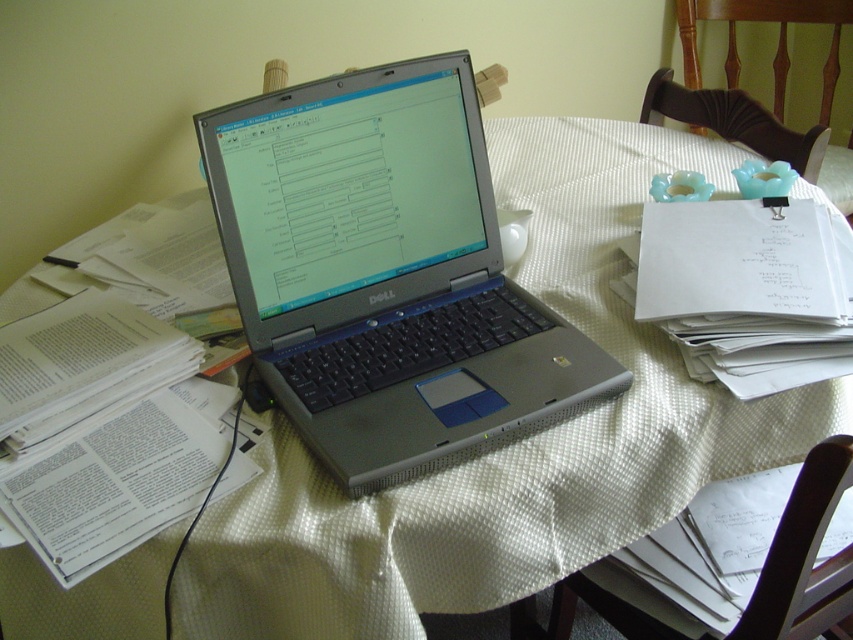
How distant is silver metallic laptop at center from white paper at upper right?

9.87 inches

Which of these two, silver metallic laptop at center or white paper at upper right, stands taller?

Standing taller between the two is silver metallic laptop at center.

Is point (532, 320) farther from camera compared to point (769, 333)?

Yes.

You are a GUI agent. You are given a task and a screenshot of the screen. Output one action in this format:
    pyautogui.click(x=<x>, y=<y>)
    Task: Click on the silver metallic laptop at center
    This screenshot has height=640, width=853.
    Given the screenshot: What is the action you would take?
    pyautogui.click(x=386, y=273)